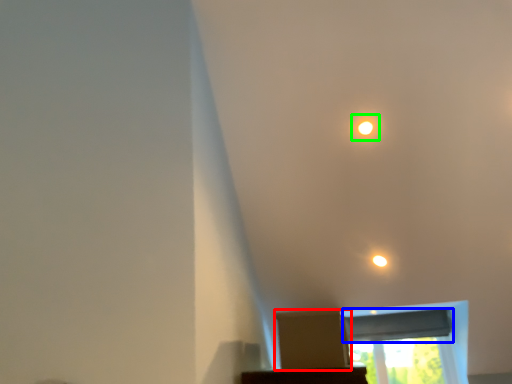
Question: Estimate the real-world distances between objects in this image. Which object is farther from cardboard box (highlighted by a red box), window screen (highlighted by a blue box) or dot (highlighted by a green box)?

Choices:
 (A) window screen
 (B) dot

Answer: (A)